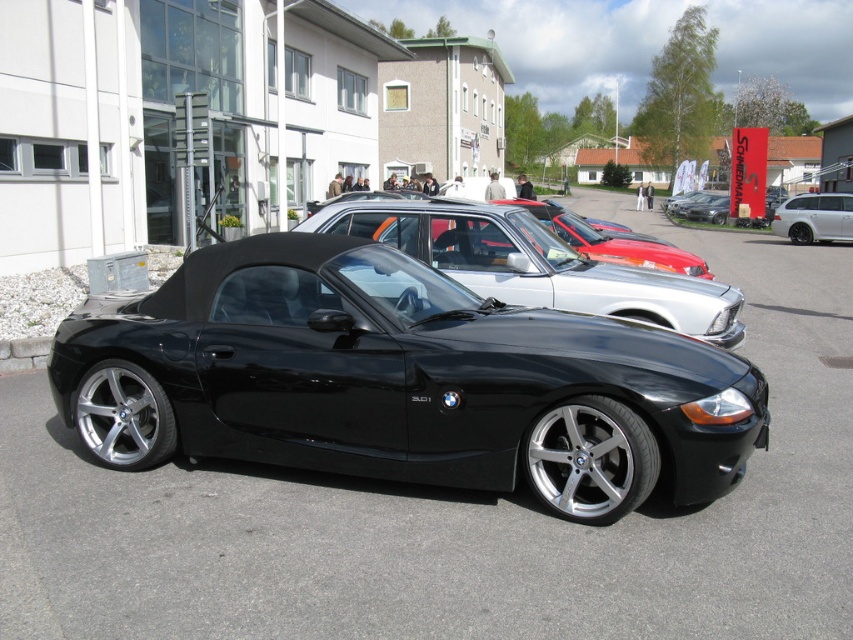
How much distance is there between black car at center and white metallic suv at right?

The distance of black car at center from white metallic suv at right is 15.06 meters.

Who is shorter, black car at center or white metallic suv at right?

With less height is white metallic suv at right.

Between point (218, 520) and point (799, 204), which one is positioned behind?

The point (799, 204) is behind.

At what (x,y) coordinates should I click in order to perform the action: click on black car at center. Please return your answer as a coordinate pair (x, y). Looking at the image, I should click on (456, 516).

Can you confirm if black car at center is positioned to the left of silver metallic sedan at center?

In fact, black car at center is to the right of silver metallic sedan at center.

The height and width of the screenshot is (640, 853). What do you see at coordinates (456, 516) in the screenshot? I see `black car at center` at bounding box center [456, 516].

Is point (36, 632) positioned behind point (525, 269)?

No, (36, 632) is closer to viewer.

Where is `black car at center`? The height and width of the screenshot is (640, 853). black car at center is located at coordinates (456, 516).

Can you confirm if silver metallic sedan at center is bigger than white metallic suv at right?

Indeed, silver metallic sedan at center has a larger size compared to white metallic suv at right.

Is point (701, 312) positioned after point (848, 204)?

No, (701, 312) is closer to viewer.

Is point (529, 218) closer to camera compared to point (845, 211)?

Yes, it is in front of point (845, 211).

Identify the location of silver metallic sedan at center. (534, 262).